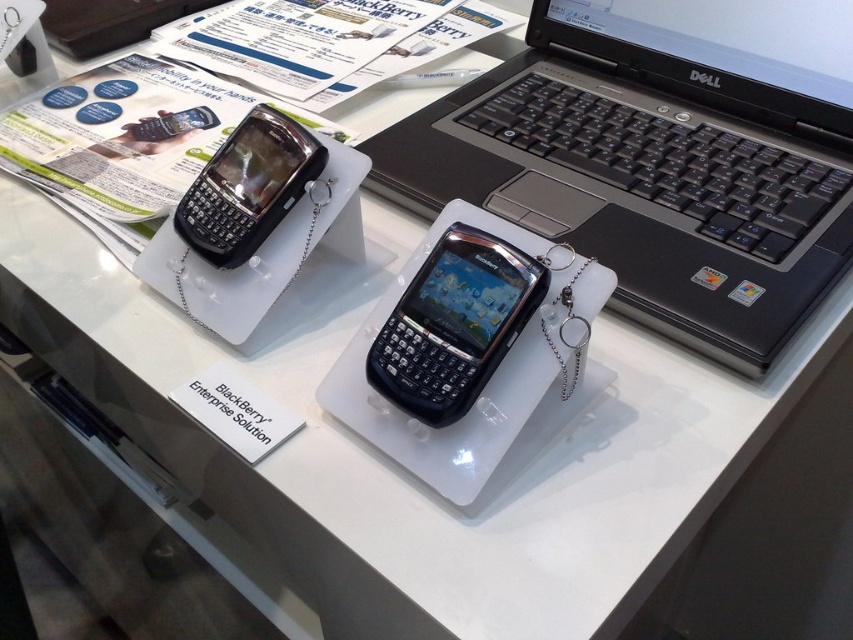
Question: Can you confirm if black matte laptop at center is positioned above black glossy phone at center?

Choices:
 (A) yes
 (B) no

Answer: (A)

Question: Which object is farther from the camera taking this photo?

Choices:
 (A) black matte laptop at center
 (B) black glossy phone at center
 (C) black glossy smartphone at center

Answer: (B)

Question: Which point is farther from the camera taking this photo?

Choices:
 (A) (415, 276)
 (B) (825, 52)
 (C) (213, 228)

Answer: (B)

Question: Is black matte laptop at center below black glossy smartphone at center?

Choices:
 (A) yes
 (B) no

Answer: (B)

Question: Which point appears farthest from the camera in this image?

Choices:
 (A) (579, 124)
 (B) (479, 298)
 (C) (222, 205)

Answer: (A)

Question: Does black matte laptop at center lie behind black glossy smartphone at center?

Choices:
 (A) no
 (B) yes

Answer: (B)